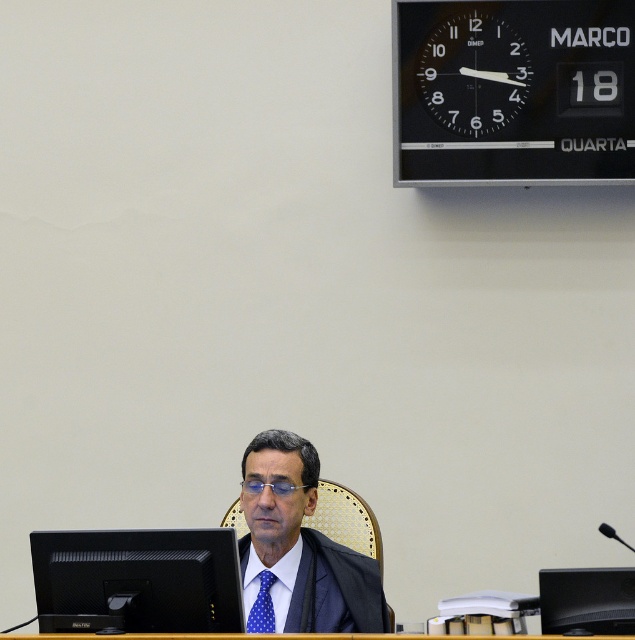
You are a tailor who needs to determine if the dark blue textured suit at center can fit into a storage box designed for items no wider than the black plastic clock at upper center. Based on the scene, will the suit fit?

The dark blue textured suit at center is wider than the black plastic clock at upper center, so it will not fit into the storage box designed for items no wider than the clock.